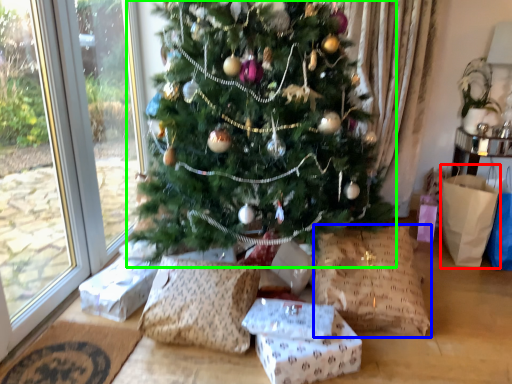
Question: Which is nearer to the shopping bag (highlighted by a red box)? pillow (highlighted by a blue box) or christmas tree (highlighted by a green box).

Choices:
 (A) pillow
 (B) christmas tree

Answer: (A)